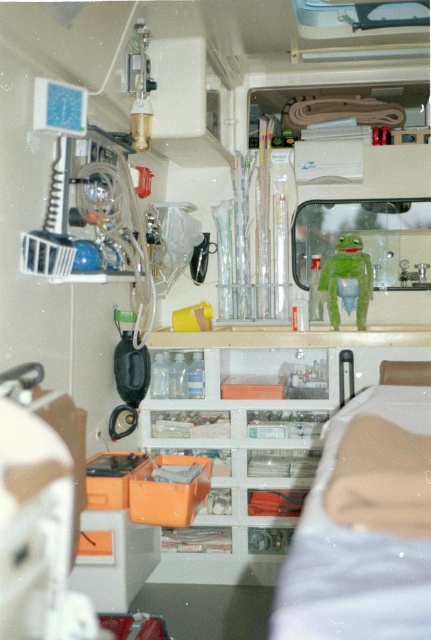
Does beige fabric bed at center appear under green matte kermit the frog at center?

Indeed, beige fabric bed at center is positioned under green matte kermit the frog at center.

Is beige fabric bed at center to the left of green matte kermit the frog at center from the viewer's perspective?

Yes, beige fabric bed at center is to the left of green matte kermit the frog at center.

What do you see at coordinates (365, 525) in the screenshot? I see `beige fabric bed at center` at bounding box center [365, 525].

The image size is (431, 640). What are the coordinates of `beige fabric bed at center` in the screenshot? It's located at (365, 525).

Does clear plastic shelf at center have a smaller size compared to beige fabric bed at center?

Actually, clear plastic shelf at center might be larger than beige fabric bed at center.

Who is more forward, (300, 344) or (305, 625)?

Point (305, 625) is more forward.

Find the location of `clear plastic shelf at center`. clear plastic shelf at center is located at coordinates point(262,435).

In the scene shown: Between clear plastic shelf at center and green matte kermit the frog at center, which one appears on the left side from the viewer's perspective?

From the viewer's perspective, clear plastic shelf at center appears more on the left side.

This screenshot has width=431, height=640. Find the location of `clear plastic shelf at center`. clear plastic shelf at center is located at coordinates (262, 435).